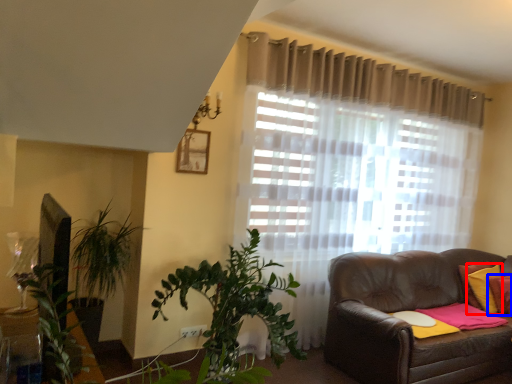
Question: Among these objects, which one is farthest to the camera, pillow (highlighted by a red box) or pillow (highlighted by a blue box)?

Choices:
 (A) pillow
 (B) pillow

Answer: (A)